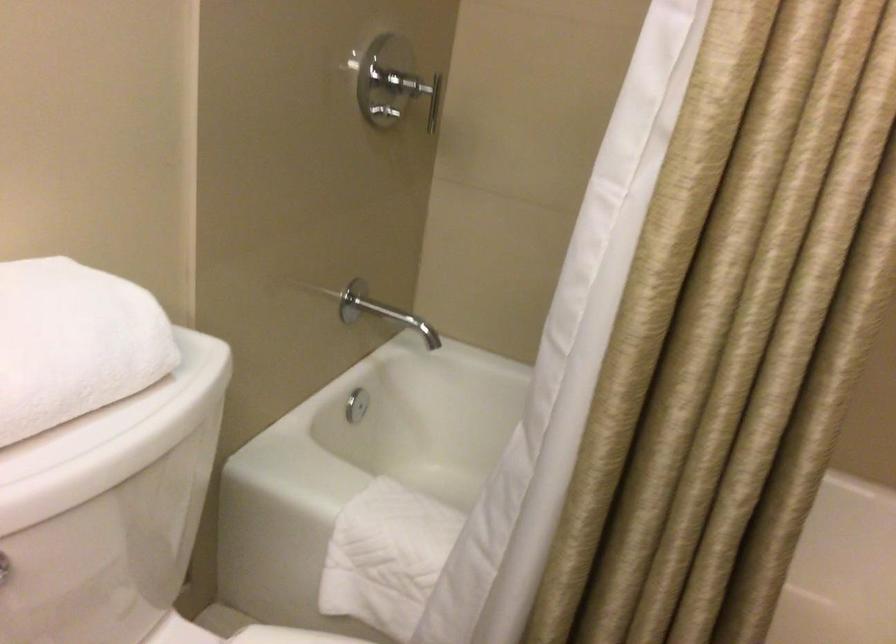
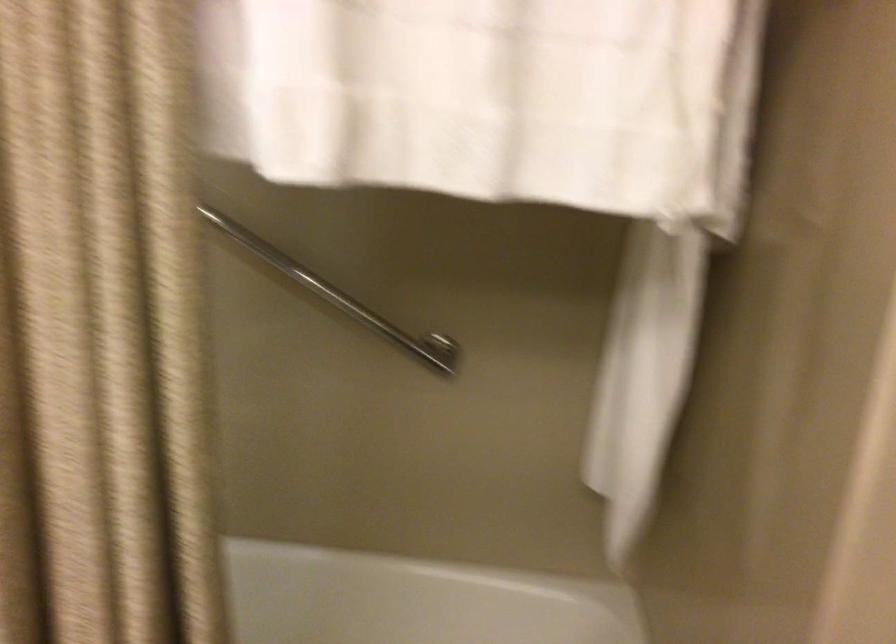
Question: The camera is either moving clockwise (left) or counter-clockwise (right) around the object. The first image is from the beginning of the video and the second image is from the end. Is the camera moving left or right when shooting the video?

Choices:
 (A) Left
 (B) Right

Answer: (A)